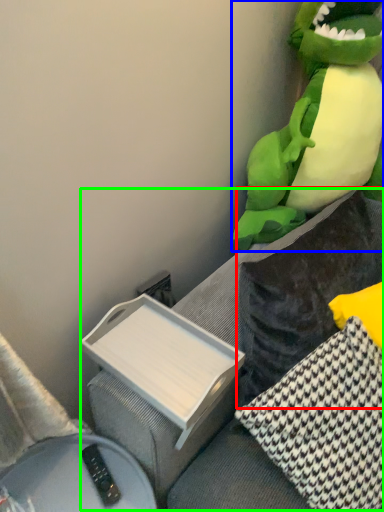
Question: Which object is positioned farthest from pillow (highlighted by a red box)? Select from toy (highlighted by a blue box) and couch (highlighted by a green box).

Choices:
 (A) toy
 (B) couch

Answer: (A)